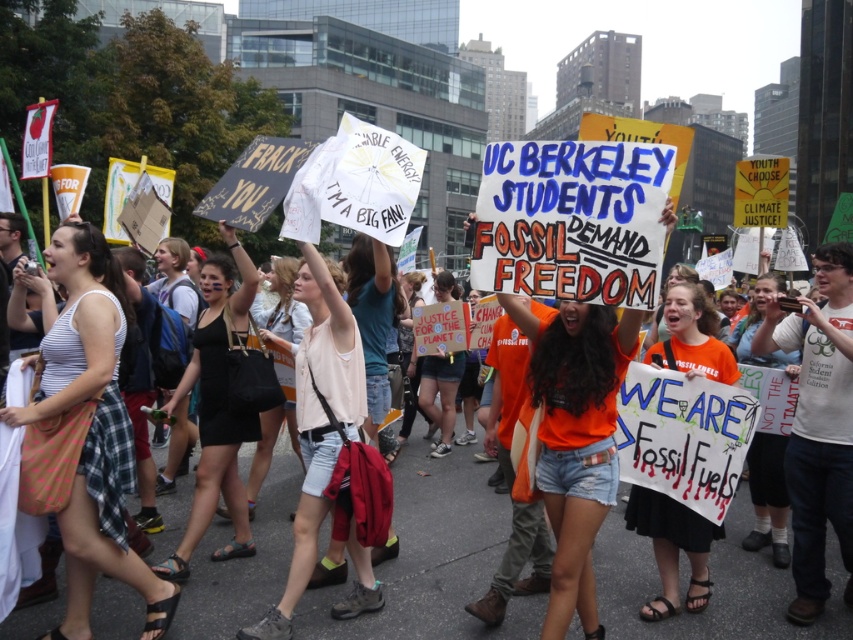
You are a photographer at the protest scene trying to capture a candid shot. You notice the striped fabric tank top at left and the white cotton shirt at center. Which clothing item is narrower in width?

The striped fabric tank top at left is narrower in width than the white cotton shirt at center.

Based on the scene description, which clothing item is taller between the striped fabric tank top at left and the light pink fabric shirt at center?

The striped fabric tank top at left is much taller than the light pink fabric shirt at center.

From the picture: You are a photographer standing in the middle of the protest crowd. You want to take a closeup shot of the striped fabric tank top at left. Can you reach it without moving closer than 3 meters?

The striped fabric tank top at left is 3.53 meters away from the viewer, so you can take a closeup shot without moving closer than 3 meters because the distance is sufficient.